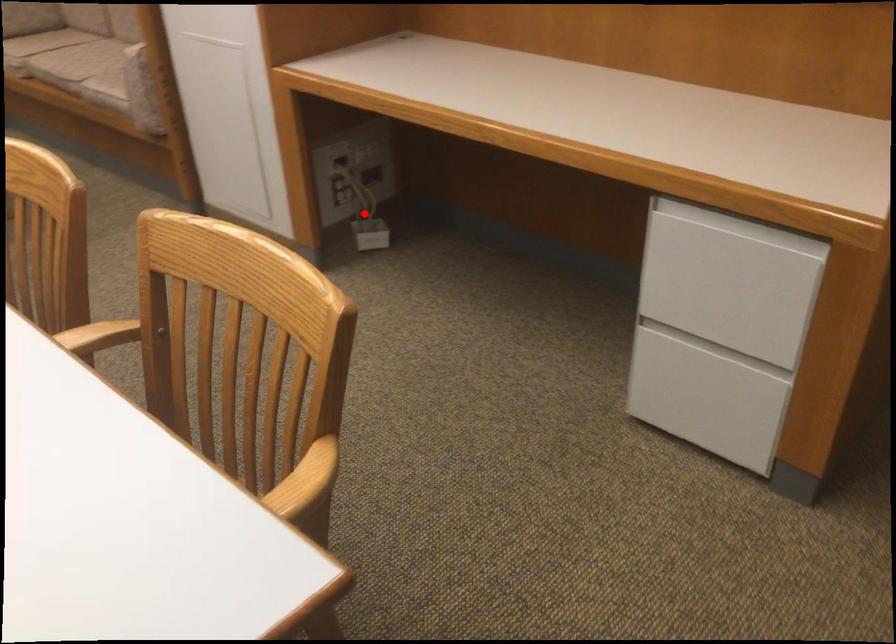
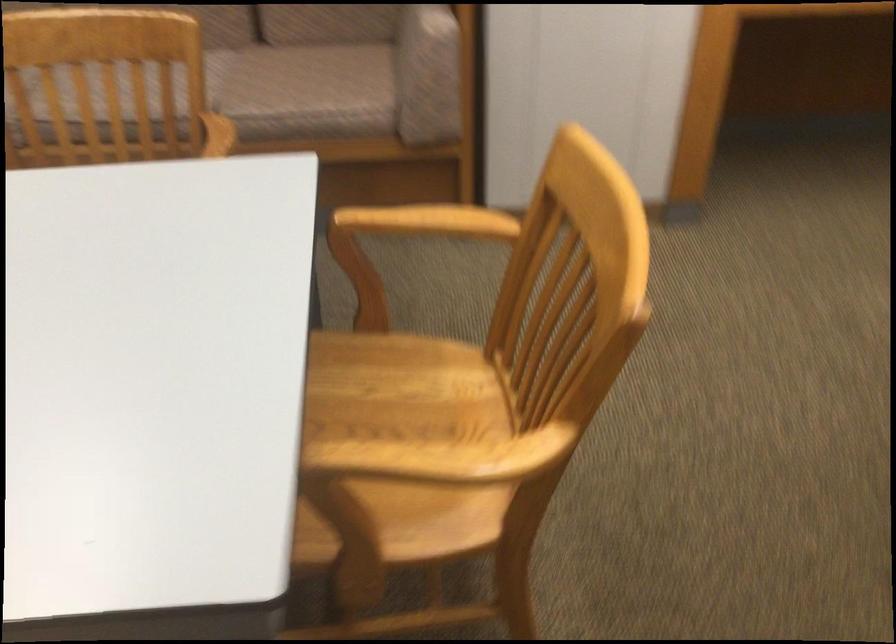
Question: I am providing you with two images of the same scene from different viewpoints. A red point is marked on the first image. At the location where the point appears in image 1, is it still visible in image 2?

Choices:
 (A) Yes
 (B) No

Answer: (B)